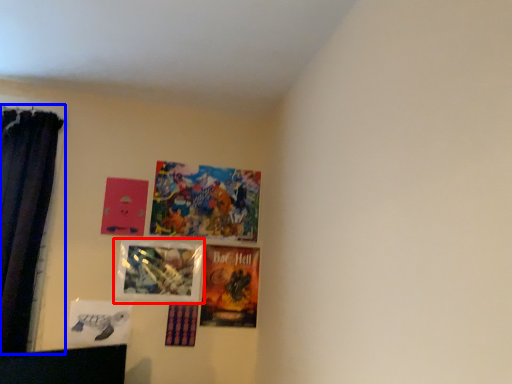
Question: Which object appears farthest to the camera in this image, picture frame (highlighted by a red box) or curtain (highlighted by a blue box)?

Choices:
 (A) picture frame
 (B) curtain

Answer: (A)